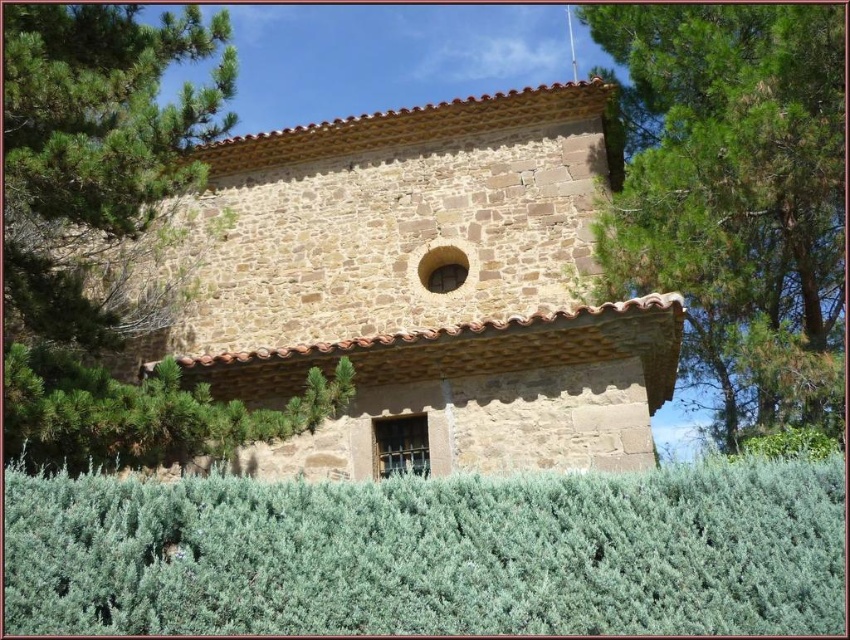
Question: Which is farther from the green leafy tree at upper right?

Choices:
 (A) green leafy tree at upper left
 (B) green leafy bush at lower left

Answer: (A)

Question: Can you confirm if green leafy tree at upper left is positioned above green leafy bush at lower left?

Choices:
 (A) no
 (B) yes

Answer: (B)

Question: Is green leafy tree at upper right further to the viewer compared to green leafy tree at upper left?

Choices:
 (A) no
 (B) yes

Answer: (B)

Question: Among these points, which one is farthest from the camera?

Choices:
 (A) pos(744,410)
 (B) pos(582,483)

Answer: (A)

Question: Which point is closer to the camera taking this photo?

Choices:
 (A) (187, 180)
 (B) (102, 625)
 (C) (836, 218)
 (D) (129, 396)

Answer: (B)

Question: Can you confirm if green leafy tree at upper left is smaller than green leafy bush at lower left?

Choices:
 (A) yes
 (B) no

Answer: (B)